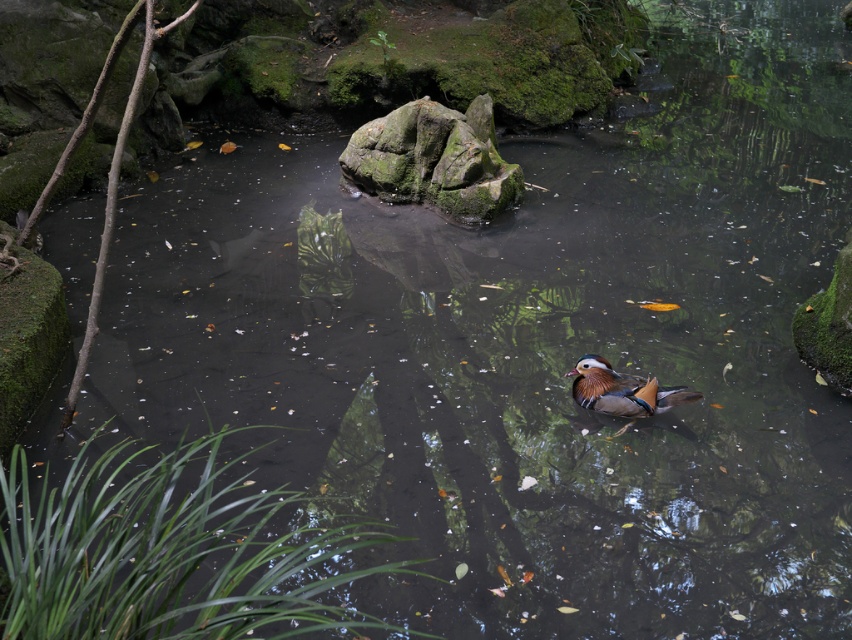
You are a photographer trying to capture the shiny orange duck at center and the green mossy rock at center in a single shot. Given that your camera has a fixed focal length, which object should you prioritize framing closer to the edge of the frame to ensure both are visible?

You should prioritize framing the green mossy rock at center closer to the edge of the frame because its width is larger than the shiny orange duck at center, allowing more space for the duck while keeping both in the shot.

You are a photographer trying to capture the shiny orange duck at center and the green mossy rock at center in the same frame. Based on their positions, which object is closer to the left side of your camera view?

The green mossy rock at center is positioned to the left of the shiny orange duck at center, so it is closer to the left side of the camera view.